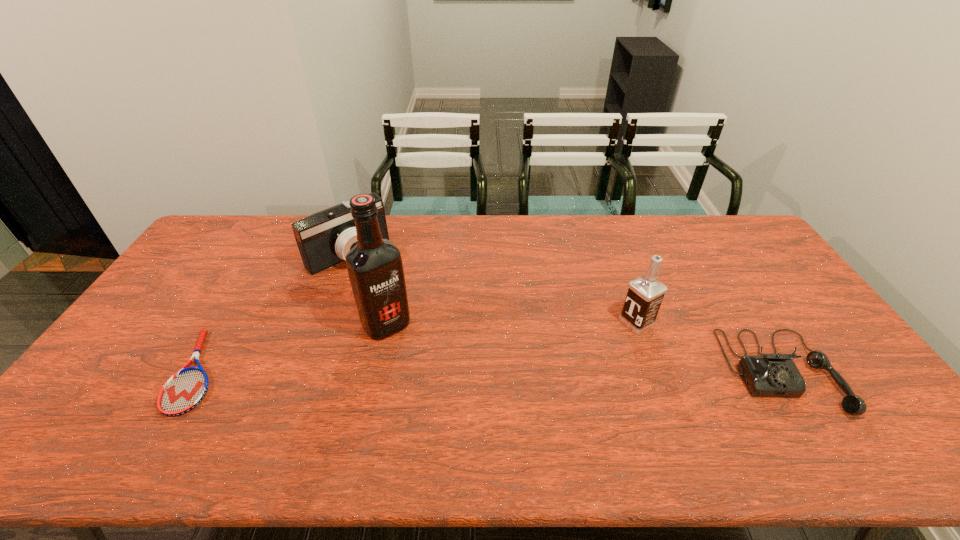
You are a GUI agent. You are given a task and a screenshot of the screen. Output one action in this format:
    pyautogui.click(x=<x>, y=<y>)
    Task: Click on the vacant space that satisfies the following two spatial constraints: 1. on the back side of the leftmost object; 2. on the right side of the farthest object
    
    Given the screenshot: What is the action you would take?
    pyautogui.click(x=268, y=254)